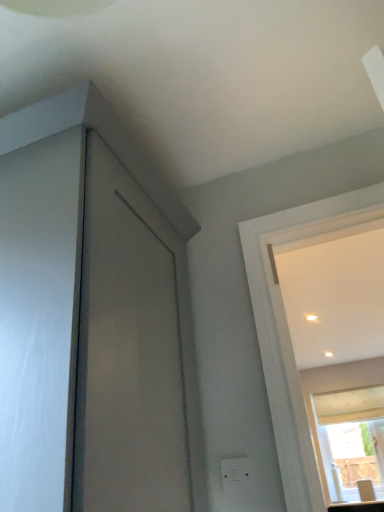
Question: Should I look upward or downward to see white plastic electric outlet at lower center?

Choices:
 (A) up
 (B) down

Answer: (B)

Question: Is matte white countertop at lower right thinner than transparent glass window at upper right?

Choices:
 (A) yes
 (B) no

Answer: (B)

Question: Is matte white countertop at lower right at the right side of transparent glass window at upper right?

Choices:
 (A) no
 (B) yes

Answer: (A)

Question: Considering the relative sizes of matte white countertop at lower right and transparent glass window at upper right in the image provided, is matte white countertop at lower right bigger than transparent glass window at upper right?

Choices:
 (A) yes
 (B) no

Answer: (B)

Question: Is matte white countertop at lower right smaller than transparent glass window at upper right?

Choices:
 (A) yes
 (B) no

Answer: (A)

Question: Does matte white countertop at lower right appear on the left side of transparent glass window at upper right?

Choices:
 (A) no
 (B) yes

Answer: (B)

Question: Is matte white countertop at lower right not close to transparent glass window at upper right?

Choices:
 (A) yes
 (B) no

Answer: (B)

Question: Can you confirm if transparent glass window at upper right is taller than white plastic electric outlet at lower center?

Choices:
 (A) yes
 (B) no

Answer: (A)

Question: Considering the relative sizes of transparent glass window at upper right and white plastic electric outlet at lower center in the image provided, is transparent glass window at upper right shorter than white plastic electric outlet at lower center?

Choices:
 (A) no
 (B) yes

Answer: (A)

Question: Considering the relative positions of transparent glass window at upper right and white plastic electric outlet at lower center in the image provided, is transparent glass window at upper right to the right of white plastic electric outlet at lower center from the viewer's perspective?

Choices:
 (A) no
 (B) yes

Answer: (B)

Question: Is transparent glass window at upper right facing away from white plastic electric outlet at lower center?

Choices:
 (A) no
 (B) yes

Answer: (A)

Question: Is transparent glass window at upper right located outside white plastic electric outlet at lower center?

Choices:
 (A) yes
 (B) no

Answer: (A)

Question: Is transparent glass window at upper right facing towards white plastic electric outlet at lower center?

Choices:
 (A) no
 (B) yes

Answer: (B)

Question: Does white plastic electric outlet at lower center turn towards matte white countertop at lower right?

Choices:
 (A) yes
 (B) no

Answer: (B)